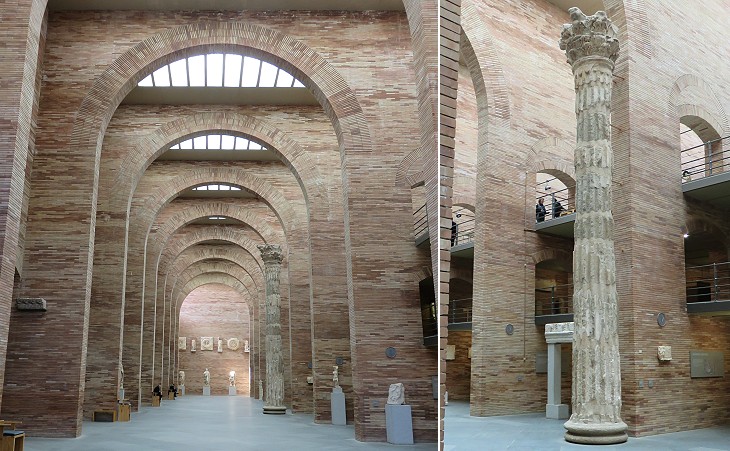
The height and width of the screenshot is (451, 730). Find the location of `wood stands`. wood stands is located at coordinates (15, 441), (125, 414), (158, 402), (172, 398).